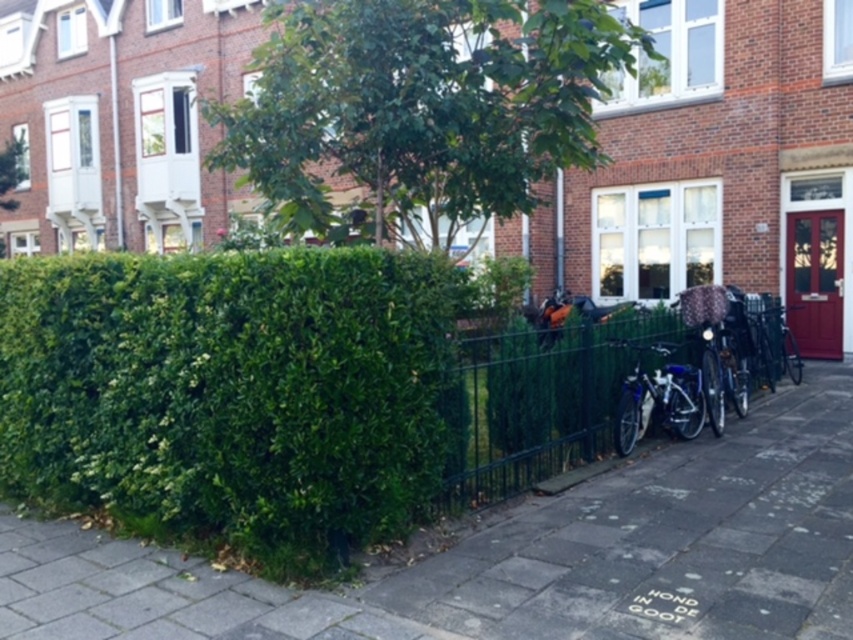
Question: Is green leafy hedge at center to the left of green metal fence at lower center from the viewer's perspective?

Choices:
 (A) no
 (B) yes

Answer: (B)

Question: Among these objects, which one is nearest to the camera?

Choices:
 (A) green metal fence at lower center
 (B) green leafy hedge at lower left
 (C) green leafy tree at upper left

Answer: (B)

Question: Which point is farther from the camera taking this photo?

Choices:
 (A) (312, 168)
 (B) (665, 353)
 (C) (541, 352)
 (D) (383, 616)

Answer: (A)

Question: Can you confirm if green leafy hedge at lower left is positioned to the left of shiny blue bicycle at center?

Choices:
 (A) yes
 (B) no

Answer: (A)

Question: Which object appears closest to the camera in this image?

Choices:
 (A) green leafy tree at upper left
 (B) green leafy hedge at lower left
 (C) shiny blue bicycle at center
 (D) green leafy hedge at center

Answer: (B)

Question: Can you confirm if green leafy hedge at lower left is positioned above green leafy tree at upper left?

Choices:
 (A) no
 (B) yes

Answer: (A)